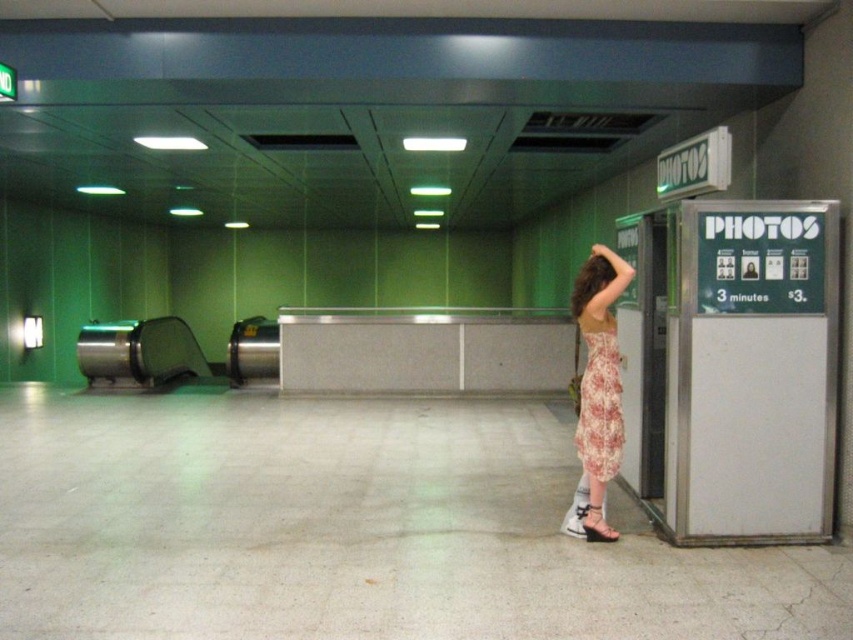
Question: Is floral dress at right bigger than floral print fabric dress at right?

Choices:
 (A) no
 (B) yes

Answer: (B)

Question: Where is floral dress at right located in relation to white leather sandal at lower right in the image?

Choices:
 (A) left
 (B) right

Answer: (B)

Question: Which is nearer to the floral print fabric dress at right?

Choices:
 (A) white leather sandal at lower right
 (B) floral dress at right

Answer: (B)

Question: Which of the following is the closest to the observer?

Choices:
 (A) (602, 269)
 (B) (614, 426)

Answer: (B)

Question: Is floral print fabric dress at right behind white leather sandal at lower right?

Choices:
 (A) no
 (B) yes

Answer: (A)

Question: Estimate the real-world distances between objects in this image. Which object is farther from the floral print fabric dress at right?

Choices:
 (A) floral dress at right
 (B) white leather sandal at lower right

Answer: (B)